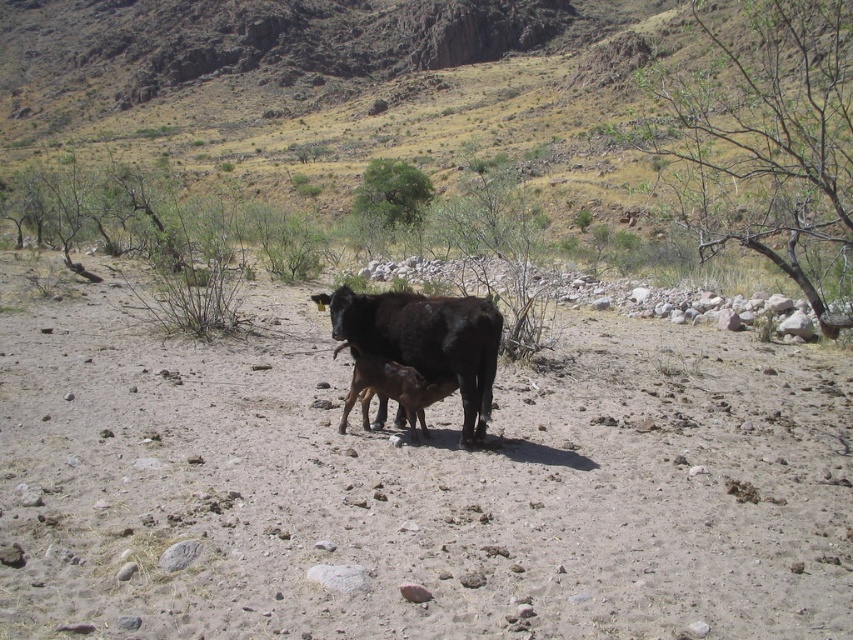
Question: Is dirt field at center below dull brown grassland at center?

Choices:
 (A) no
 (B) yes

Answer: (B)

Question: Which point is farther from the camera taking this photo?

Choices:
 (A) (213, 4)
 (B) (482, 298)

Answer: (A)

Question: Does dirt field at center have a larger size compared to dull brown grassland at center?

Choices:
 (A) no
 (B) yes

Answer: (A)

Question: Among these points, which one is nearest to the camera?

Choices:
 (A) (585, 83)
 (B) (404, 346)
 (C) (33, 472)

Answer: (C)

Question: Which of the following is the farthest from the observer?

Choices:
 (A) (523, 51)
 (B) (485, 403)

Answer: (A)

Question: Where is dull brown grassland at center located in relation to black glossy cow at center in the image?

Choices:
 (A) right
 (B) left

Answer: (B)